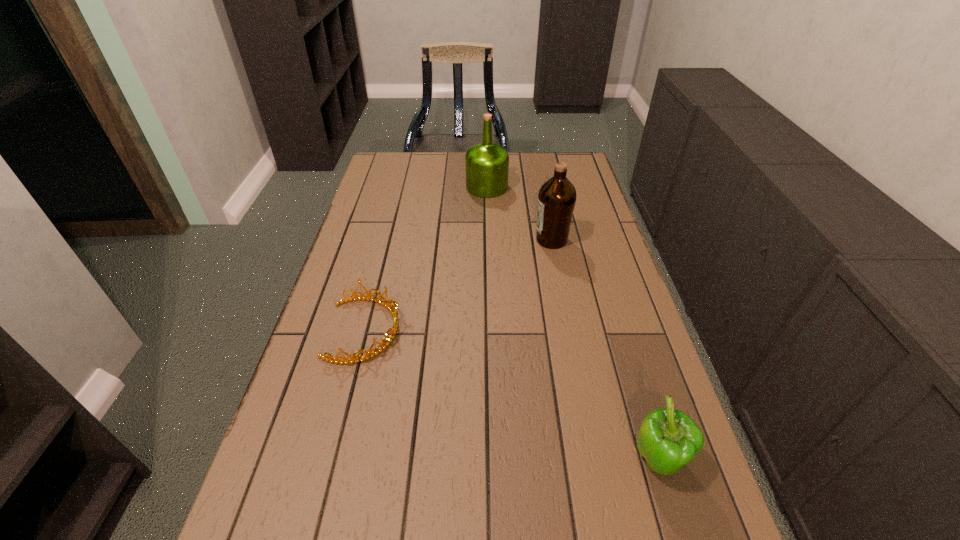
Image resolution: width=960 pixels, height=540 pixels. In order to click on the second object from left to right in this screenshot , I will do `click(487, 163)`.

The width and height of the screenshot is (960, 540). What are the coordinates of `the farthest object` in the screenshot? It's located at (487, 163).

The height and width of the screenshot is (540, 960). I want to click on the second farthest object, so click(x=557, y=196).

The width and height of the screenshot is (960, 540). Identify the location of the third object from left to right. [557, 196].

Image resolution: width=960 pixels, height=540 pixels. What are the coordinates of `the second shortest object` in the screenshot? It's located at (668, 439).

The width and height of the screenshot is (960, 540). I want to click on bell pepper, so click(668, 439).

You are a GUI agent. You are given a task and a screenshot of the screen. Output one action in this format:
    pyautogui.click(x=<x>, y=<y>)
    Task: Click on the leftmost object
    
    Given the screenshot: What is the action you would take?
    pyautogui.click(x=390, y=307)

Locate an element on the screen. This screenshot has width=960, height=540. the third farthest object is located at coordinates (390, 307).

Locate an element on the screen. The height and width of the screenshot is (540, 960). vacant space located 0.230m on the right of the second object from left to right is located at coordinates (572, 187).

Where is `vacant space located on the label of the third object from left to right`? vacant space located on the label of the third object from left to right is located at coordinates (475, 240).